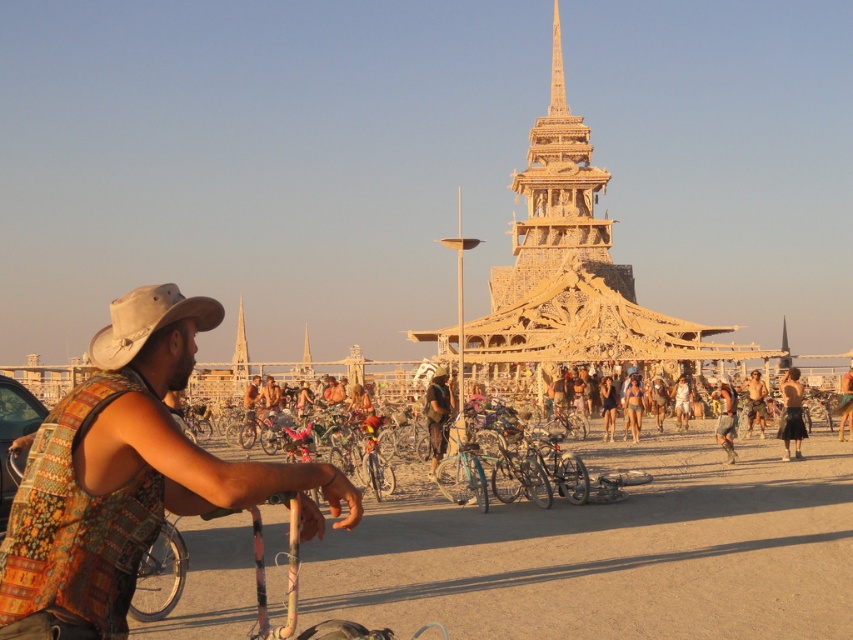
Can you confirm if rustic wood bicycle at center is taller than black fabric shorts at center?

Correct, rustic wood bicycle at center is much taller as black fabric shorts at center.

Which is behind, point (433, 449) or point (601, 397)?

The point (601, 397) is more distant.

Which is in front, point (442, 392) or point (610, 387)?

Point (442, 392) is more forward.

Identify the location of rustic wood bicycle at center. The image size is (853, 640). (437, 413).

How distant is beige sand at center from rustic wood bicycle at center?

20.06 meters

Can you confirm if beige sand at center is positioned above rustic wood bicycle at center?

No, beige sand at center is not above rustic wood bicycle at center.

Is point (399, 566) more distant than point (440, 372)?

No, it is in front of (440, 372).

Find the location of a particular element. This screenshot has width=853, height=640. beige sand at center is located at coordinates (608, 548).

Based on the photo, does beige sand at center have a lesser width compared to printed fabric vest at left?

No, beige sand at center is not thinner than printed fabric vest at left.

Is beige sand at center further to the viewer compared to printed fabric vest at left?

Yes, beige sand at center is behind printed fabric vest at left.

You are a GUI agent. You are given a task and a screenshot of the screen. Output one action in this format:
    pyautogui.click(x=<x>, y=<y>)
    Task: Click on the beige sand at center
    
    Given the screenshot: What is the action you would take?
    pyautogui.click(x=608, y=548)